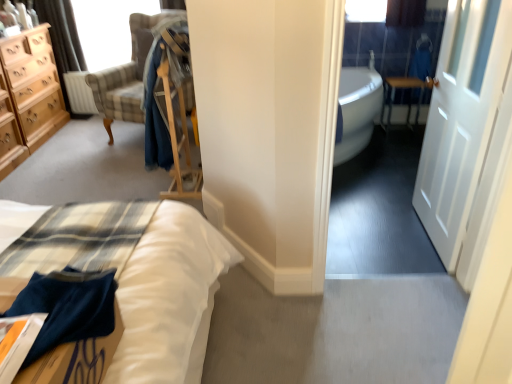
Find the location of a particular element. vacant area on top of white leather bed at lower left (from a real-world perspective) is located at coordinates (88, 237).